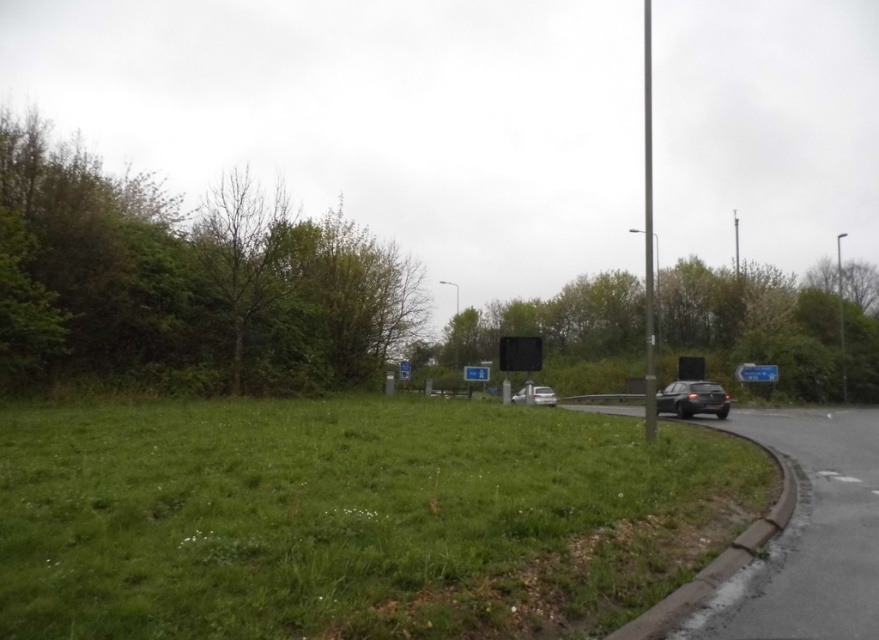
Question: Which of these objects is positioned farthest from the white glossy car at center?

Choices:
 (A) metallic pole at right
 (B) green leafy tree at left

Answer: (A)

Question: Is green leafy tree at center positioned at the back of metallic pole at right?

Choices:
 (A) no
 (B) yes

Answer: (A)

Question: Does blue plastic sign at right appear on the right side of white glossy car at center?

Choices:
 (A) no
 (B) yes

Answer: (B)

Question: Which object is closer to the camera taking this photo?

Choices:
 (A) blue plastic sign at right
 (B) white glossy car at center
 (C) green grass at lower left
 (D) satin black car at right

Answer: (C)

Question: Which point is closer to the camera taking this photo?

Choices:
 (A) (478, 374)
 (B) (703, 394)
 (C) (485, 308)
 (D) (240, 538)

Answer: (D)

Question: Can you confirm if satin black car at right is wider than white glossy car at center?

Choices:
 (A) yes
 (B) no

Answer: (A)